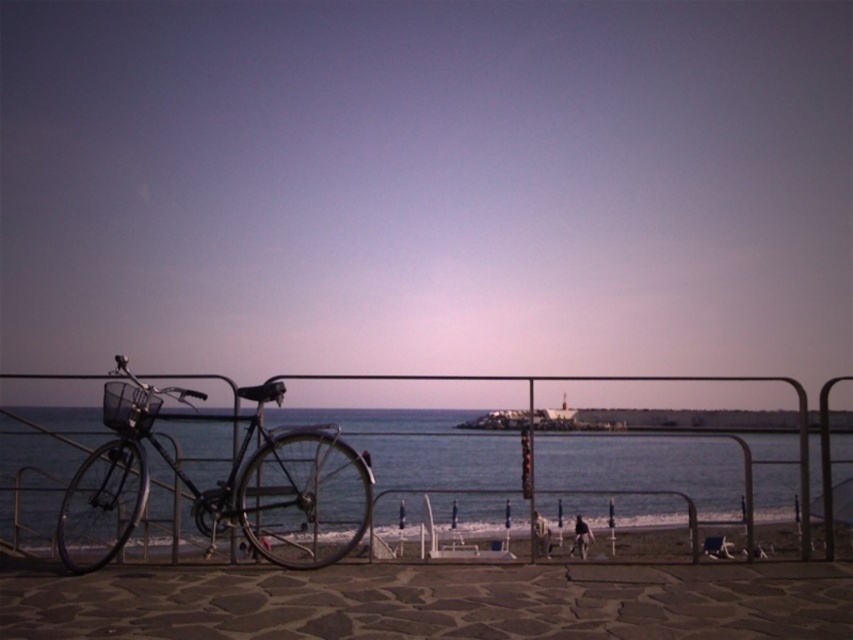
Question: Is the position of blue water at center less distant than that of shiny black bicycle at left?

Choices:
 (A) no
 (B) yes

Answer: (A)

Question: Which of the following is the farthest from the observer?

Choices:
 (A) (786, 467)
 (B) (97, 500)

Answer: (A)

Question: Which of the following is the farthest from the observer?

Choices:
 (A) blue water at center
 (B) shiny black bicycle at left

Answer: (A)

Question: Does blue water at center have a larger size compared to shiny black bicycle at left?

Choices:
 (A) yes
 (B) no

Answer: (A)

Question: Does blue water at center have a smaller size compared to shiny black bicycle at left?

Choices:
 (A) yes
 (B) no

Answer: (B)